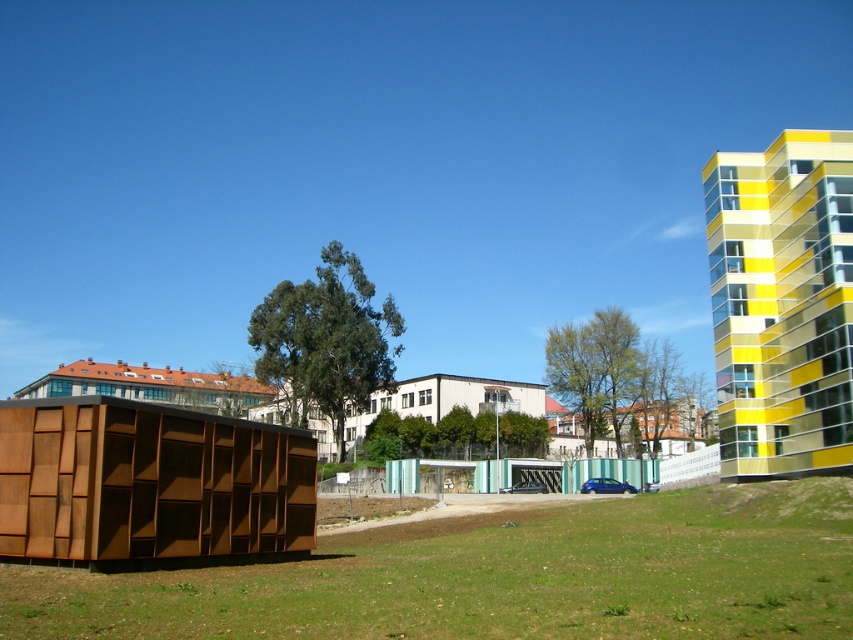
You are a city planner analyzing the urban layout. Given the yellow glass building at right and the corten steel hut at left, which structure has a greater horizontal span when viewed from above?

The yellow glass building at right has a greater horizontal span than the corten steel hut at left, as its width surpasses the latter.

You are standing in the urban landscape and want to take a photo of both the yellow glass building at right and the brown wooden hut at upper left. Which one should you focus on first to ensure both are in sharp focus?

You should focus on the yellow glass building at right first because it is closer to the viewer than the brown wooden hut at upper left, so adjusting focus from near to far will help both be in sharp focus.

You are standing at the entrance of the urban park and see the corten steel hut at left and the green grass at lower center. Which object is closer to your right side?

The green grass at lower center is to the right of the corten steel hut at left, so it is closer to your right side.